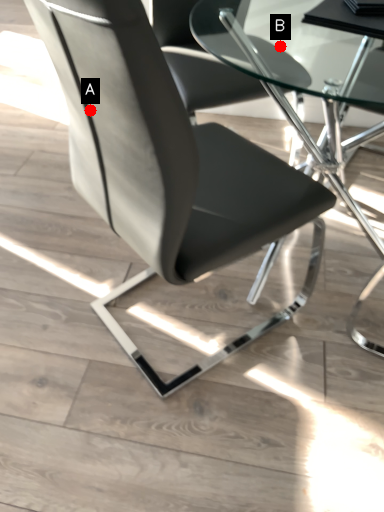
Question: Two points are circled on the image, labeled by A and B beside each circle. Among these points, which one is nearest to the camera?

Choices:
 (A) A is closer
 (B) B is closer

Answer: (A)